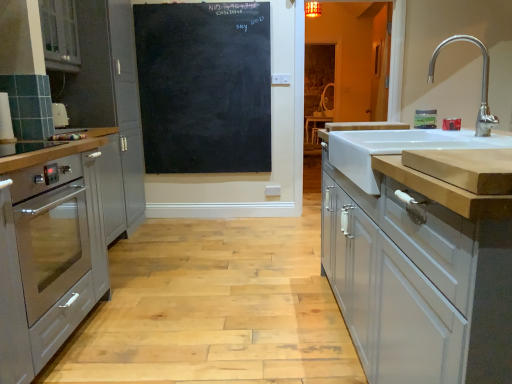
Find the location of a particular element. The height and width of the screenshot is (384, 512). free spot to the right of satin silver oven at left, the second cabinetry in the left-to-right sequence is located at coordinates (156, 233).